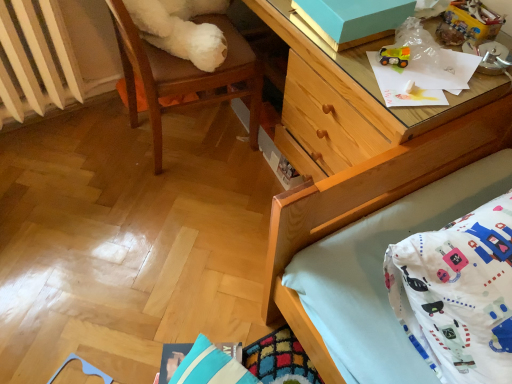
Identify the location of vacant area on the back side of rubberized yellow toy truck at upper right, the first toy positioned from the left. The image size is (512, 384). (392, 40).